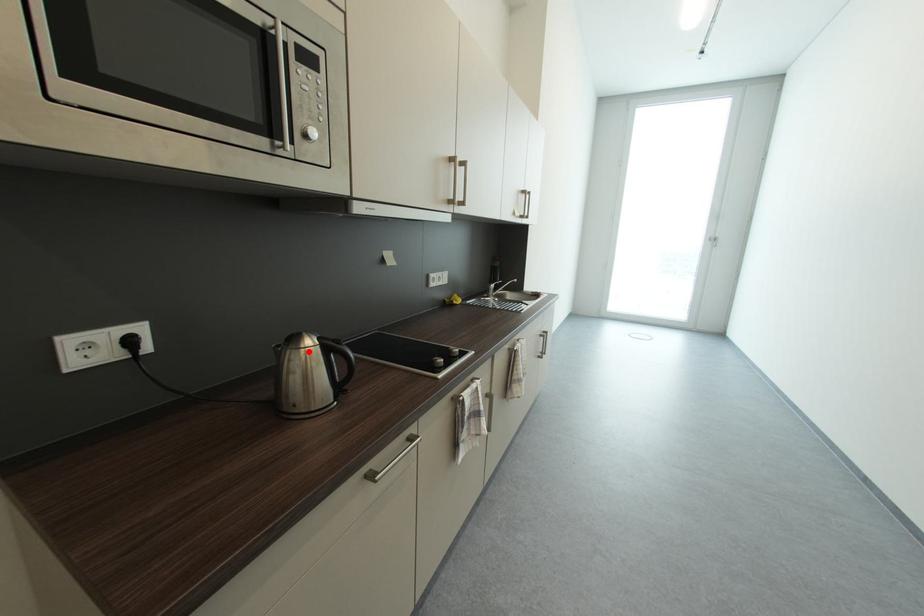
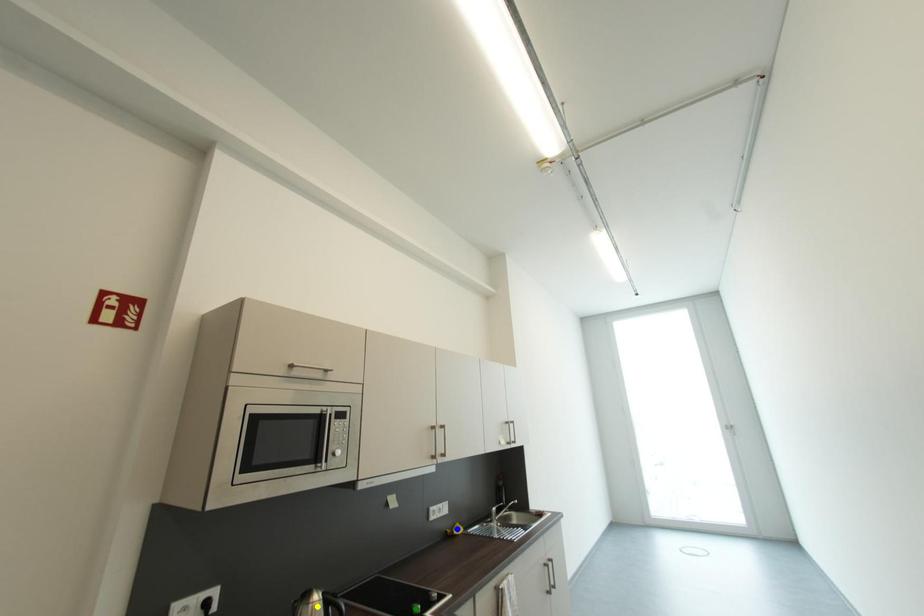
Question: I am providing you with two images of the same scene from different viewpoints. A red point is marked on the first image. You are given multiple points on the second image. Which mark in image 2 goes with the point in image 1?

Choices:
 (A) blue point
 (B) yellow point
 (C) green point

Answer: (B)